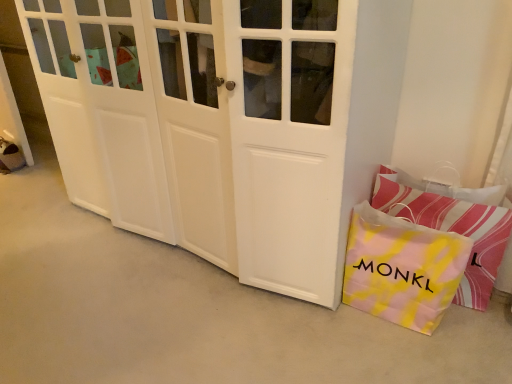
Where is `vacant space situated on the left part of yellow tie-dye paper bag at lower right`? The image size is (512, 384). vacant space situated on the left part of yellow tie-dye paper bag at lower right is located at coordinates (338, 333).